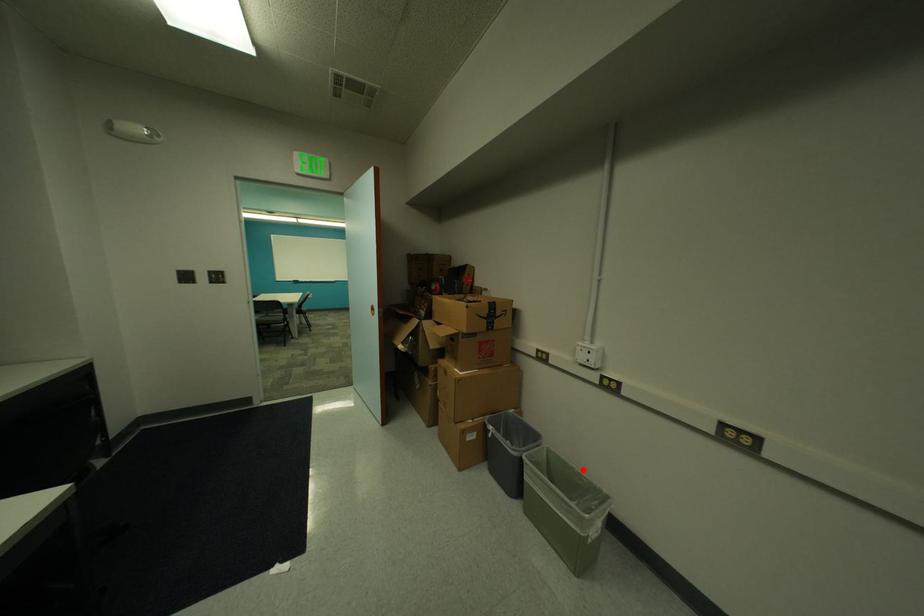
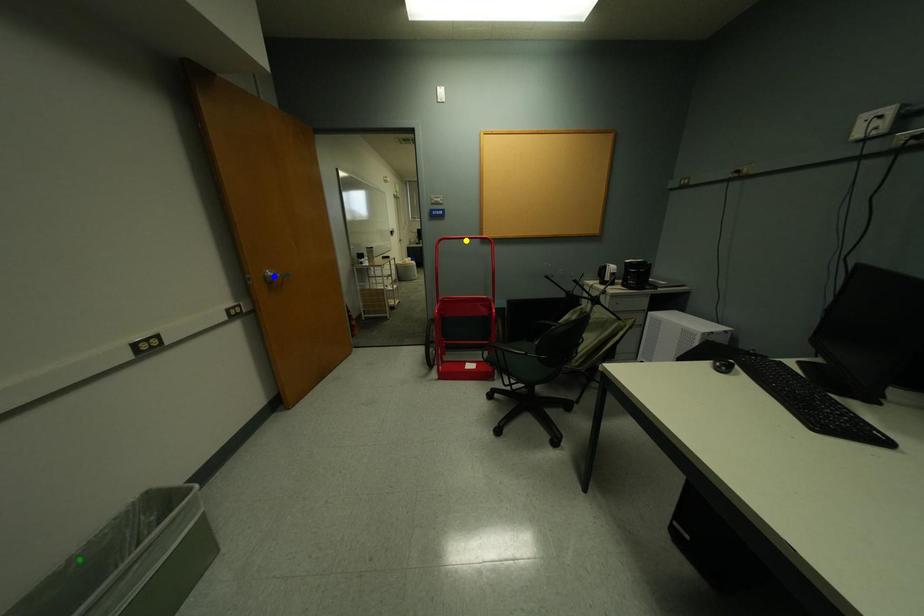
Question: I am providing you with two images of the same scene from different viewpoints. A red point is marked on the first image. You are given multiple points on the second image. In image 2, which mark is for the same physical point as the one in image 1?

Choices:
 (A) green point
 (B) yellow point
 (C) blue point

Answer: (A)